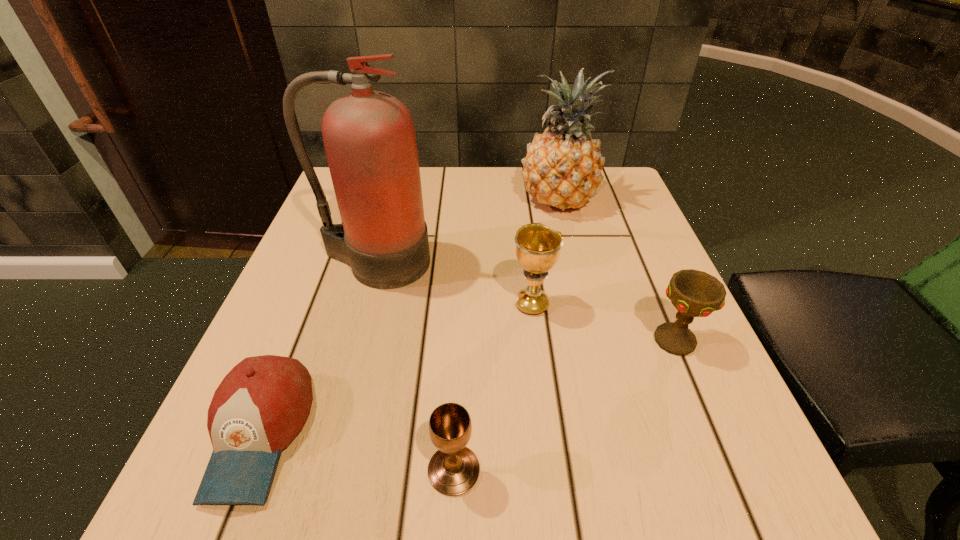
Locate an element on the screen. Image resolution: width=960 pixels, height=540 pixels. chalice that is the third closest to the fire extinguisher is located at coordinates (693, 293).

The height and width of the screenshot is (540, 960). What are the coordinates of `chalice object that ranks as the second closest to the shortest object` in the screenshot? It's located at (538, 247).

At what (x,y) coordinates should I click in order to perform the action: click on free location that satisfies the following two spatial constraints: 1. on the front side of the fourth farthest object; 2. on the left side of the tallest chalice. Please return your answer as a coordinate pair (x, y). Looking at the image, I should click on (537, 341).

I want to click on blank space that satisfies the following two spatial constraints: 1. on the front side of the third nearest object; 2. on the left side of the pineapple, so click(592, 341).

Locate an element on the screen. Image resolution: width=960 pixels, height=540 pixels. free point that satisfies the following two spatial constraints: 1. at the nozzle of the second chalice from right to left; 2. on the right side of the fire extinguisher is located at coordinates (364, 305).

The height and width of the screenshot is (540, 960). Find the location of `vacant space that satisfies the following two spatial constraints: 1. at the nozzle of the farthest chalice; 2. on the right side of the fire extinguisher`. vacant space that satisfies the following two spatial constraints: 1. at the nozzle of the farthest chalice; 2. on the right side of the fire extinguisher is located at coordinates coord(364,305).

Identify the location of vacant area in the image that satisfies the following two spatial constraints: 1. at the nozzle of the tallest object; 2. on the left side of the fourth shortest object. The width and height of the screenshot is (960, 540). pos(364,305).

The width and height of the screenshot is (960, 540). What are the coordinates of `vacant region that satisfies the following two spatial constraints: 1. on the front-facing side of the leftmost chalice; 2. on the right side of the baseball cap` in the screenshot? It's located at (246, 470).

Locate an element on the screen. The image size is (960, 540). vacant point that satisfies the following two spatial constraints: 1. at the nozzle of the fire extinguisher; 2. on the right side of the fourth object from right to left is located at coordinates click(x=318, y=470).